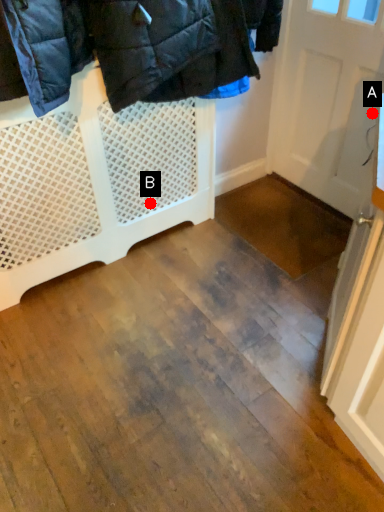
Question: Two points are circled on the image, labeled by A and B beside each circle. Which point appears farthest from the camera in this image?

Choices:
 (A) A is further
 (B) B is further

Answer: (B)